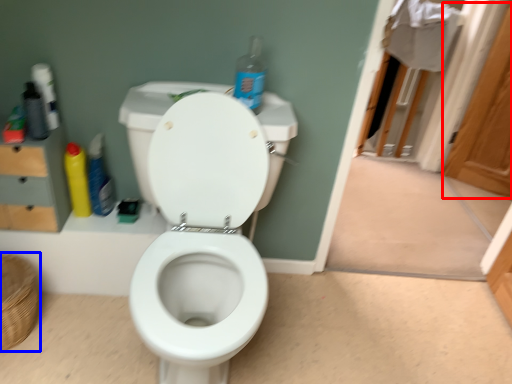
Question: Which point is closer to the camera, screen door (highlighted by a red box) or basket (highlighted by a blue box)?

Choices:
 (A) screen door
 (B) basket

Answer: (B)